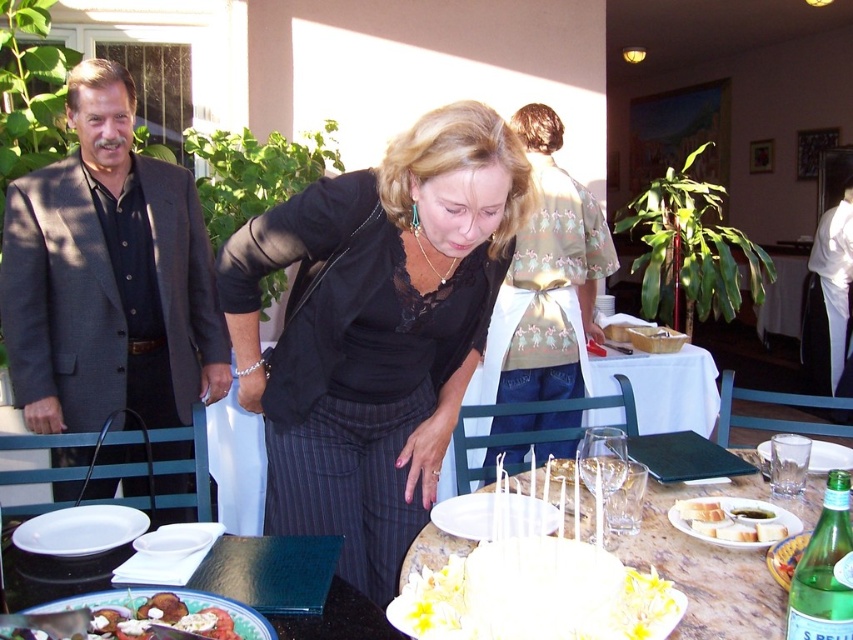
You are a guest at this birthday gathering and want to grab a drink from the green glass bottle at center. However, you need to move your hand past the white bread at table to reach it. Based on their positions, which object is on the right side when looking from the table towards you?

The green glass bottle at center is on the right side of the white bread at table, so you can reach it by moving your hand towards the right from the white bread at table.